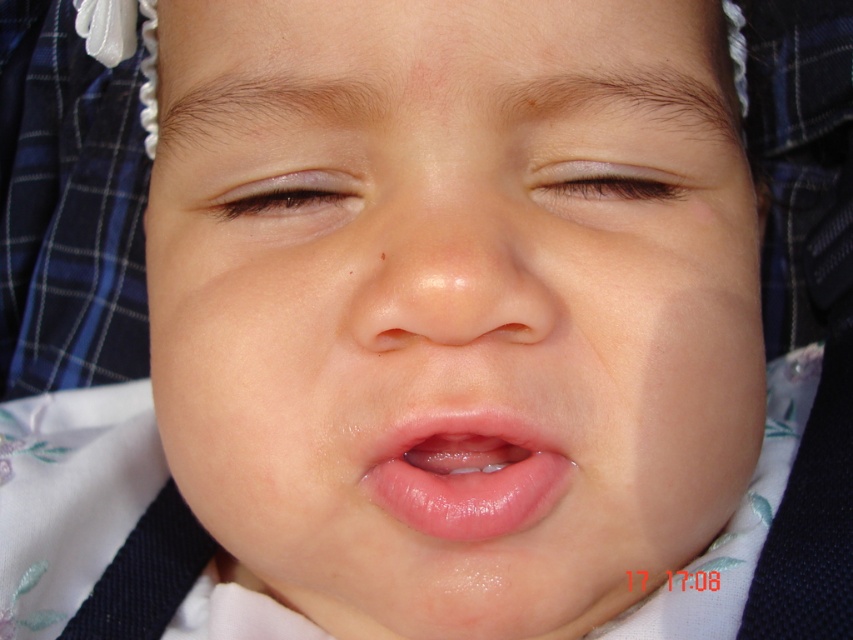
Based on the scene description, can you determine which object is wider between the smooth skin face at center and the brown matte eye at upper left?

The smooth skin face at center is wider than the brown matte eye at upper left.

Looking at the baby in the image, which object is wider when comparing the smooth skin face at center and the glossy pink lips at center?

The smooth skin face at center is wider than the glossy pink lips at center.

You are a photographer trying to capture a close portrait of a baby. The baby is currently positioned such that the smooth skin face at center is 26.32 centimeters away from the camera lens. According to photography guidelines, the ideal distance for a close baby portrait is between 25 to 30 centimeters. Is the current distance within the recommended range?

The smooth skin face at center is 26.32 centimeters away from the camera, which falls within the recommended 25 to 30 centimeter range for a close baby portrait. Therefore, the current distance is acceptable.